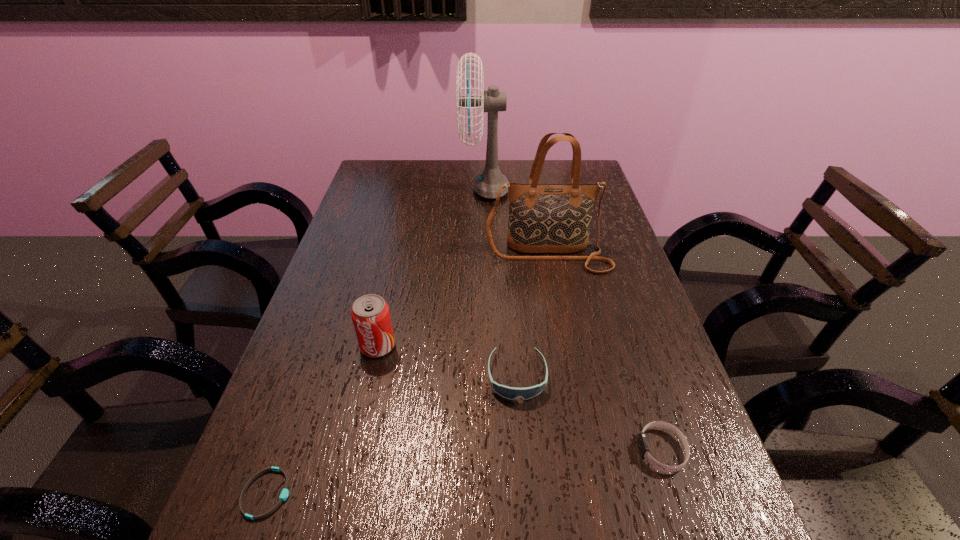
Where is `the leftmost object`? The height and width of the screenshot is (540, 960). the leftmost object is located at coordinates (284, 494).

The height and width of the screenshot is (540, 960). I want to click on free location located 0.100m on the front-facing side of the farthest object, so click(x=431, y=188).

The width and height of the screenshot is (960, 540). In order to click on vacant space located 0.100m on the front-facing side of the farthest object in this screenshot , I will do `click(431, 188)`.

This screenshot has width=960, height=540. I want to click on vacant region located on the front-facing side of the farthest object, so click(378, 188).

Locate an element on the screen. free space located 0.390m on the front-facing side of the fifth nearest object is located at coordinates pos(576,402).

This screenshot has height=540, width=960. Identify the location of vacant area situated 0.200m on the front of the second object from left to right. (355, 447).

The width and height of the screenshot is (960, 540). In order to click on vacant space situated 0.090m on the front-facing side of the third shortest object in this screenshot , I will do `click(522, 446)`.

At what (x,y) coordinates should I click in order to perform the action: click on vacant region located 0.050m on the outer surface of the right wristband. Please return your answer as a coordinate pair (x, y). Looking at the image, I should click on (612, 450).

Where is `free space located on the outer surface of the right wristband`? This screenshot has width=960, height=540. free space located on the outer surface of the right wristband is located at coordinates (606, 450).

This screenshot has height=540, width=960. What are the coordinates of `free spot located 0.070m on the outer surface of the right wristband` in the screenshot? It's located at (600, 450).